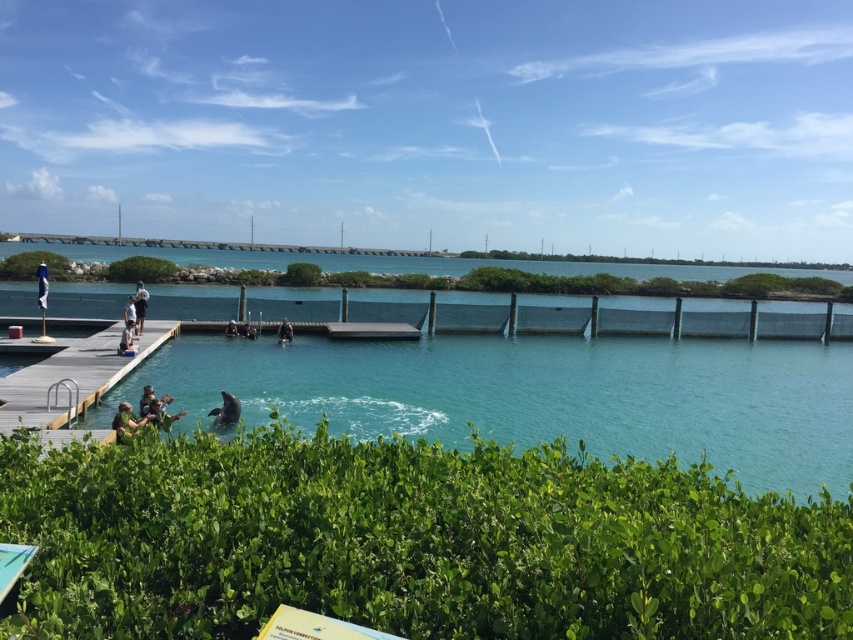
Is green leafy bush at left bigger than blue fabric umbrella at upper center?

Yes, green leafy bush at left is bigger than blue fabric umbrella at upper center.

Can you confirm if green leafy bush at left is positioned above blue fabric umbrella at upper center?

Yes, green leafy bush at left is above blue fabric umbrella at upper center.

Is point (16, 275) behind point (42, 301)?

Yes, it is behind point (42, 301).

You are a GUI agent. You are given a task and a screenshot of the screen. Output one action in this format:
    pyautogui.click(x=<x>, y=<y>)
    Task: Click on the green leafy bush at left
    The width and height of the screenshot is (853, 640).
    Given the screenshot: What is the action you would take?
    pyautogui.click(x=32, y=264)

Can you confirm if dark blue fabric shirt at left is positioned above dark blue fabric person at center?

Incorrect, dark blue fabric shirt at left is not positioned above dark blue fabric person at center.

Locate an element on the screen. dark blue fabric shirt at left is located at coordinates (126, 339).

The width and height of the screenshot is (853, 640). I want to click on dark blue fabric shirt at left, so click(x=126, y=339).

Does wooden dock at lower left have a smaller size compared to blue fabric umbrella at upper center?

Indeed, wooden dock at lower left has a smaller size compared to blue fabric umbrella at upper center.

Which is below, wooden dock at lower left or blue fabric umbrella at upper center?

wooden dock at lower left

In order to click on wooden dock at lower left in this screenshot , I will do [70, 376].